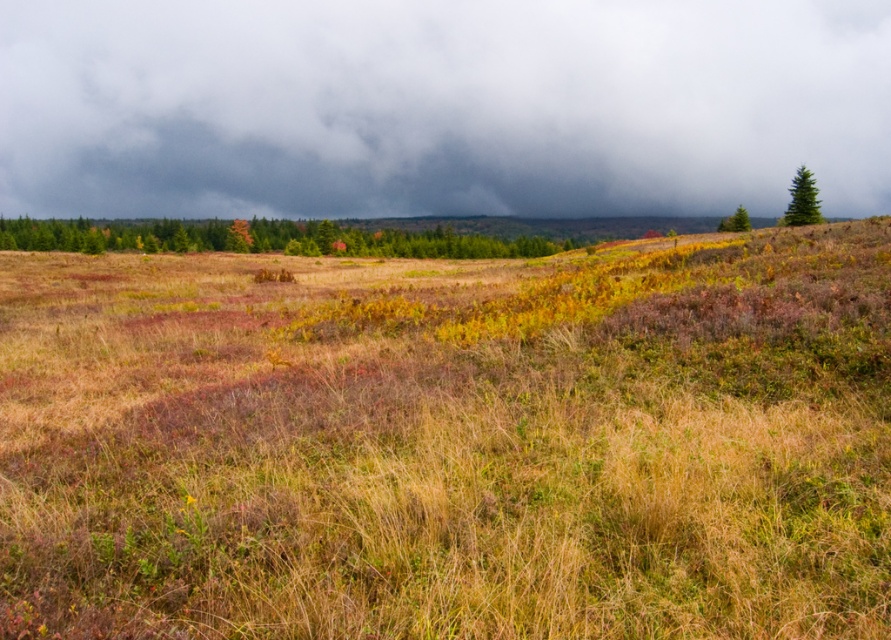
Question: Which point appears farthest from the camera in this image?

Choices:
 (A) (807, 630)
 (B) (260, 68)
 (C) (724, 220)

Answer: (B)

Question: Is gray cloudy sky at upper center further to camera compared to green matte tree at upper right?

Choices:
 (A) no
 (B) yes

Answer: (B)

Question: Which of the following is the closest to the observer?

Choices:
 (A) (405, 88)
 (B) (486, 392)

Answer: (B)

Question: Which of the following is the closest to the observer?

Choices:
 (A) (217, 205)
 (B) (270, 228)

Answer: (B)

Question: From the image, what is the correct spatial relationship of green matte tree at upper right in relation to green textured pine at upper right?

Choices:
 (A) left
 (B) right

Answer: (A)

Question: Can you confirm if dry grass at center is positioned below green textured pine at upper right?

Choices:
 (A) yes
 (B) no

Answer: (A)